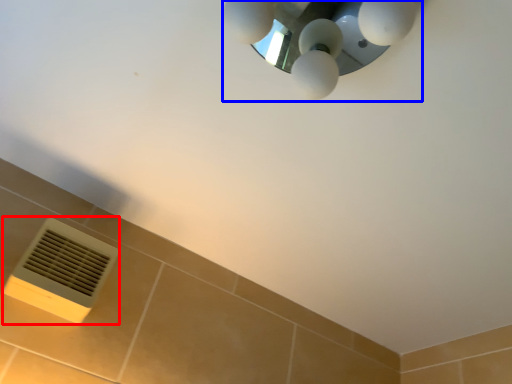
Question: Which of the following is the farthest to the observer, air conditioning (highlighted by a red box) or lamp (highlighted by a blue box)?

Choices:
 (A) air conditioning
 (B) lamp

Answer: (A)